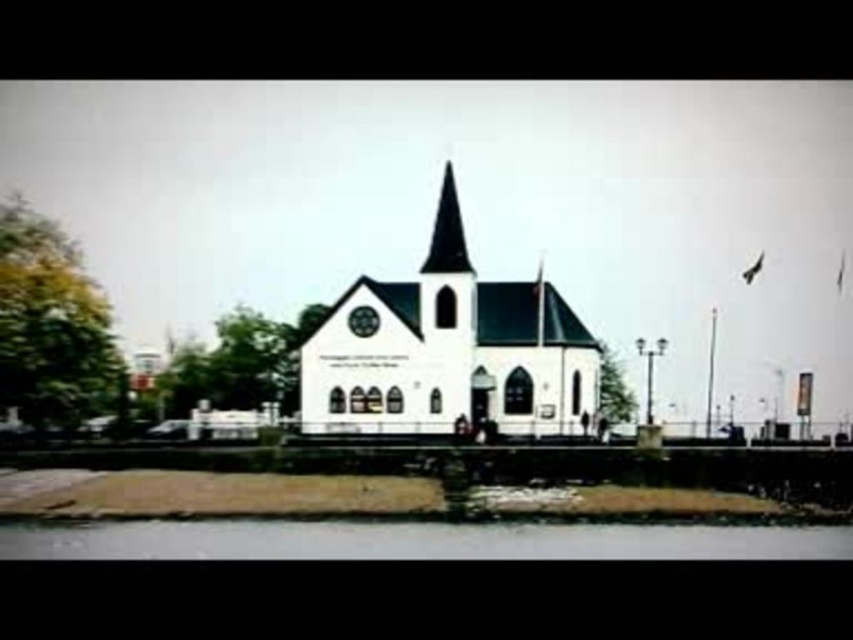
You are a photographer planning to capture the reflection of the black glass spire at center in the clear water at lower center. Given the size difference between them, what observation can you make about their reflections?

The clear water at lower center is larger in size than the black glass spire at center, so the reflection of the black glass spire at center in the clear water at lower center will be smaller than the actual spire.

You are standing at the center of the image and want to find the white matte church at center. According to the coordinates, in which direction should you look to locate it?

The white matte church at center is located at coordinates point [448,349], which is slightly to the right and just below the exact center of the image. Since you are standing at the center, you should look slightly to your right and a bit downward to locate it.

You are a photographer wanting to capture the black glass spire at center and the clear water at lower center in a single shot. Given the scene described, which object occupies a larger portion of the horizontal space in the image?

The clear water at lower center occupies a larger portion of the horizontal space since its width surpasses that of the black glass spire at center.